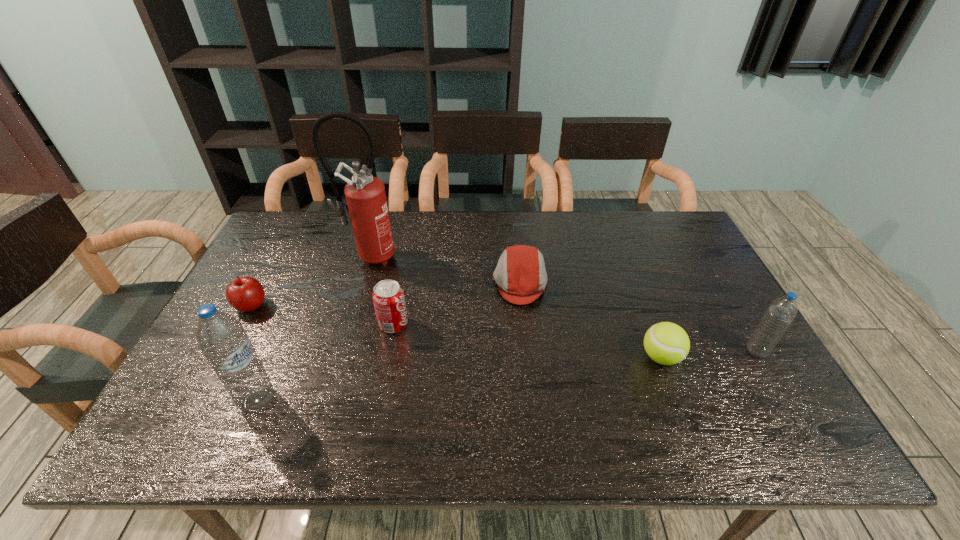
The image size is (960, 540). What are the coordinates of `vacant position located on the back of the shorter water bottle` in the screenshot? It's located at (716, 282).

You are a GUI agent. You are given a task and a screenshot of the screen. Output one action in this format:
    pyautogui.click(x=<x>, y=<y>)
    Task: Click on the free space located at the nozzle of the tallest object
    This screenshot has width=960, height=540.
    Given the screenshot: What is the action you would take?
    pyautogui.click(x=345, y=344)

Locate an element on the screen. The height and width of the screenshot is (540, 960). vacant space located 0.330m on the back of the soda is located at coordinates (410, 241).

In order to click on free region located on the right of the leftmost object in this screenshot , I will do `click(318, 306)`.

This screenshot has width=960, height=540. I want to click on blank space located on the right of the sixth object from left to right, so click(702, 357).

Where is `free space located on the front-facing side of the third object from right to left`? free space located on the front-facing side of the third object from right to left is located at coordinates (358, 282).

The image size is (960, 540). I want to click on vacant space located on the front-facing side of the third object from right to left, so click(x=396, y=282).

Where is `blank space located 0.170m on the front-facing side of the third object from right to left`? Image resolution: width=960 pixels, height=540 pixels. blank space located 0.170m on the front-facing side of the third object from right to left is located at coordinates (436, 282).

The height and width of the screenshot is (540, 960). I want to click on object that is at the far edge, so click(365, 194).

At what (x,y) coordinates should I click in order to perform the action: click on object present at the near edge. Please return your answer as a coordinate pair (x, y). Looking at the image, I should click on (221, 337).